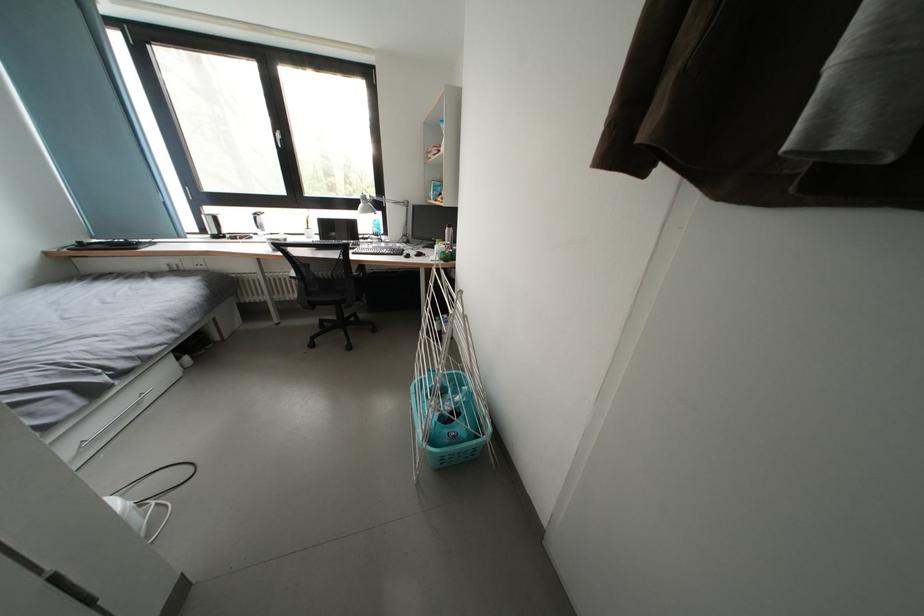
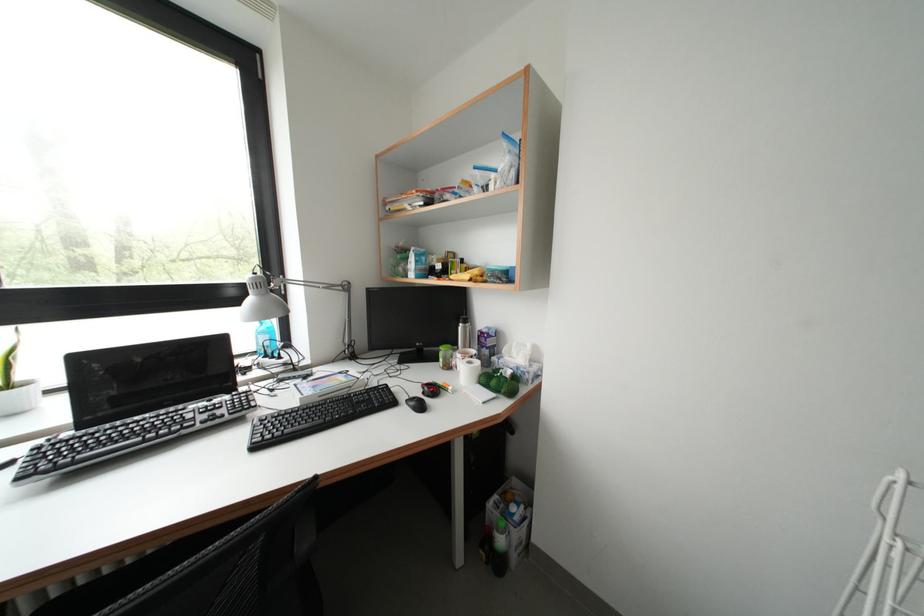
In the second image, find the point that corresponds to (383,235) in the first image.

(274, 347)